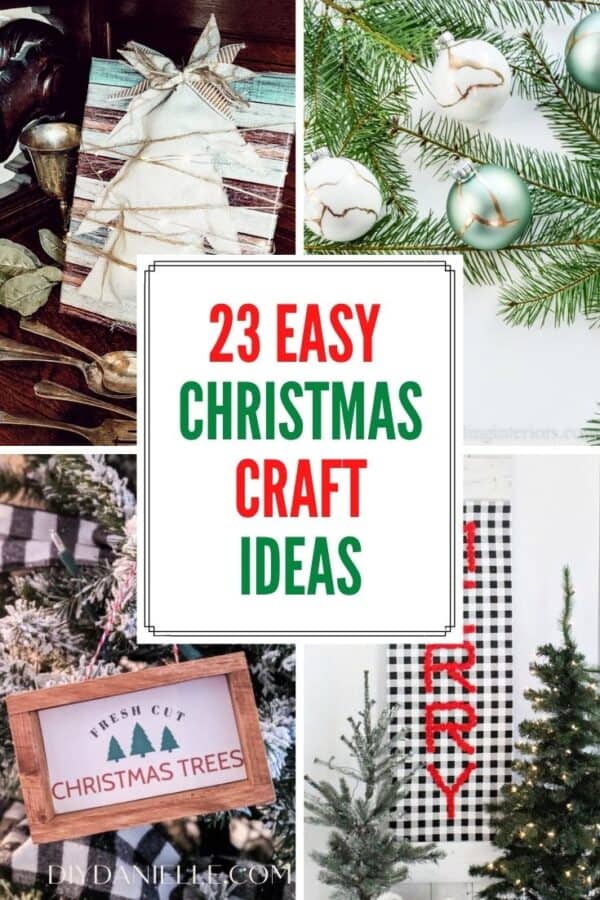
This screenshot has height=900, width=600. I want to click on candle holder, so click(x=55, y=156).